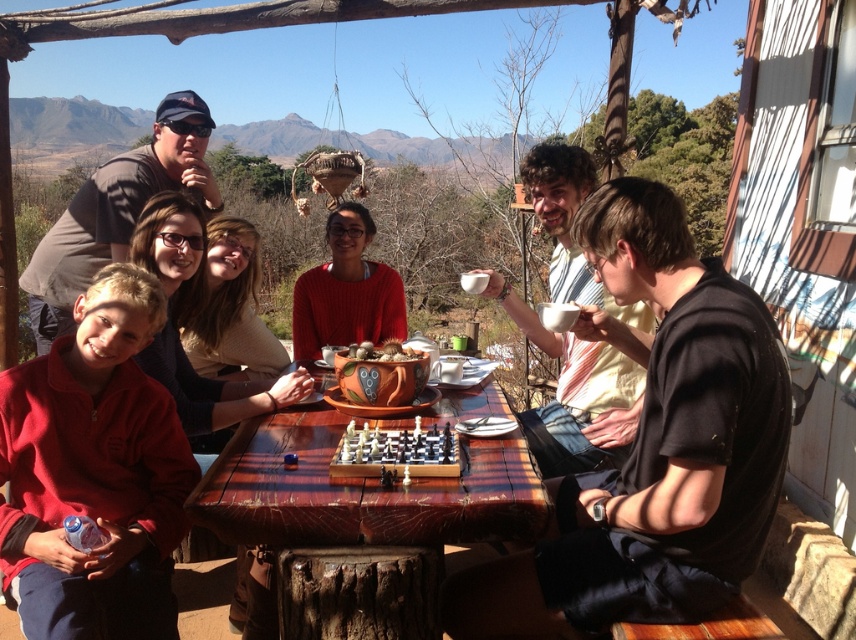
Which is below, wooden chess set at center or smooth clay pot at center?

wooden chess set at center is below.

Is wooden chess set at center thinner than smooth clay pot at center?

Incorrect, wooden chess set at center's width is not less than smooth clay pot at center's.

Between point (394, 476) and point (390, 356), which one is positioned behind?

The point (390, 356) is behind.

Identify the location of wooden chess set at center. (397, 452).

Does matte brown shirt at upper left have a greater height compared to wooden chess set at center?

Indeed, matte brown shirt at upper left has a greater height compared to wooden chess set at center.

Does matte brown shirt at upper left have a lesser width compared to wooden chess set at center?

No.

This screenshot has width=856, height=640. I want to click on matte brown shirt at upper left, so click(x=116, y=211).

Can you confirm if matte black mug at center is positioned above smooth clay pot at center?

Yes, matte black mug at center is above smooth clay pot at center.

Is matte black mug at center below smooth clay pot at center?

Actually, matte black mug at center is above smooth clay pot at center.

Is point (535, 426) closer to viewer compared to point (396, 344)?

No, it is not.

Where is `matte black mug at center`? This screenshot has height=640, width=856. matte black mug at center is located at coordinates (575, 394).